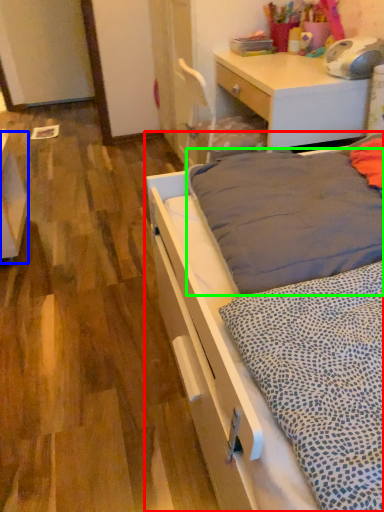
Question: Estimate the real-world distances between objects in this image. Which object is closer to bed (highlighted by a red box), vanity (highlighted by a blue box) or mattress (highlighted by a green box)?

Choices:
 (A) vanity
 (B) mattress

Answer: (B)